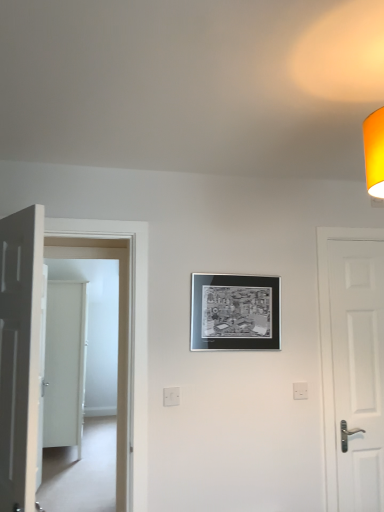
Question: In the image, is white plastic electric outlet at lower center, the first electric outlet when ordered from right to left, on the left side or the right side of white glossy door at left, which is the 3th door in back-to-front order?

Choices:
 (A) right
 (B) left

Answer: (A)

Question: From their relative heights in the image, would you say white plastic electric outlet at lower center, the first electric outlet when ordered from right to left, is taller or shorter than white glossy door at left, positioned as the third door in left-to-right order?

Choices:
 (A) tall
 (B) short

Answer: (B)

Question: Considering the real-world distances, which object is closest to the white glossy door at left, the 2th door in the front-to-back sequence?

Choices:
 (A) white matte door at left, which is the first door from front to back
 (B) white plastic electric outlet at center, which is the 1th electric outlet from left to right
 (C) white plastic electric outlet at lower center, which is counted as the first electric outlet, starting from the back
 (D) white matte door at right, the second door in the back-to-front sequence
 (E) white matte door at left, which appears as the 1th door when viewed from the left

Answer: (B)

Question: Which object is positioned farthest from the white plastic electric outlet at lower center, the 2th electric outlet viewed from the front?

Choices:
 (A) white plastic electric outlet at center, marked as the 1th electric outlet in a front-to-back arrangement
 (B) metallic silver picture frame at center
 (C) white matte door at right, acting as the first door starting from the right
 (D) white glossy door at left, the 2th door when ordered from right to left
 (E) white matte door at left, the 4th door positioned from the back

Answer: (E)